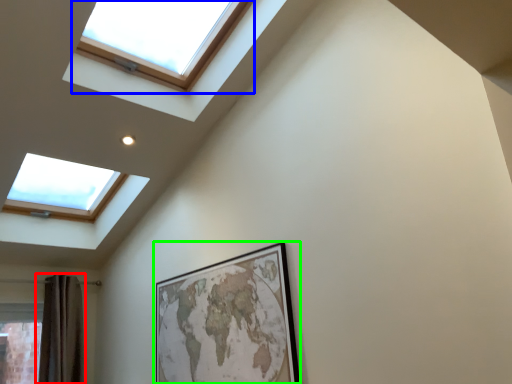
Question: Which object is the closest to the shower curtain (highlighted by a red box)? Choose among these: window (highlighted by a blue box) or picture frame (highlighted by a green box).

Choices:
 (A) window
 (B) picture frame

Answer: (B)